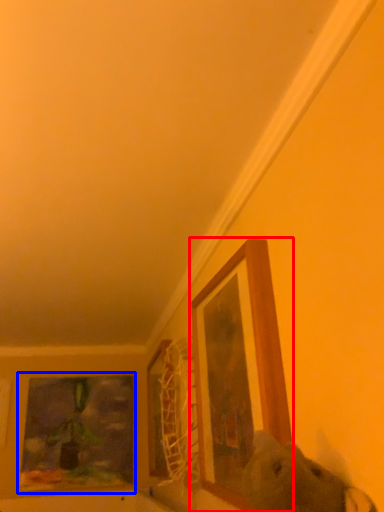
Question: Which point is further to the camera, picture frame (highlighted by a red box) or picture frame (highlighted by a blue box)?

Choices:
 (A) picture frame
 (B) picture frame

Answer: (B)